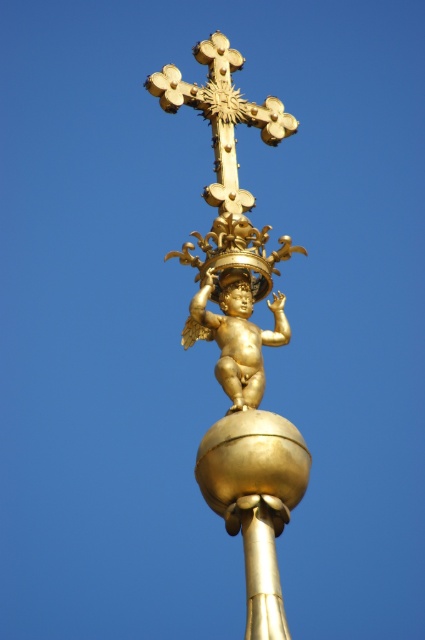
The image size is (425, 640). I want to click on gold polished crucifix at upper center, so click(221, 115).

Is point (265, 116) less distant than point (272, 584)?

No, (265, 116) is further to viewer.

This screenshot has height=640, width=425. Identify the location of gold polished crucifix at upper center. (221, 115).

Between gold metallic cherub at center and gold polished pole at center, which one is positioned higher?

Positioned higher is gold metallic cherub at center.

In order to click on gold metallic cherub at center in this screenshot , I will do `click(235, 333)`.

Can you confirm if gold polished cherub at center is positioned to the right of gold polished pole at center?

Incorrect, gold polished cherub at center is not on the right side of gold polished pole at center.

Can you confirm if gold polished cherub at center is taller than gold polished pole at center?

Yes.

Image resolution: width=425 pixels, height=640 pixels. Find the location of `gold polished cherub at center`. gold polished cherub at center is located at coordinates (240, 337).

Identify the location of gold polished cherub at center. (240, 337).